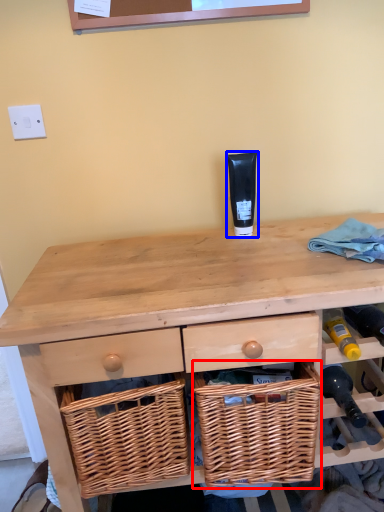
Question: Among these objects, which one is nearest to the camera, picnic basket (highlighted by a red box) or toiletry (highlighted by a blue box)?

Choices:
 (A) picnic basket
 (B) toiletry

Answer: (A)